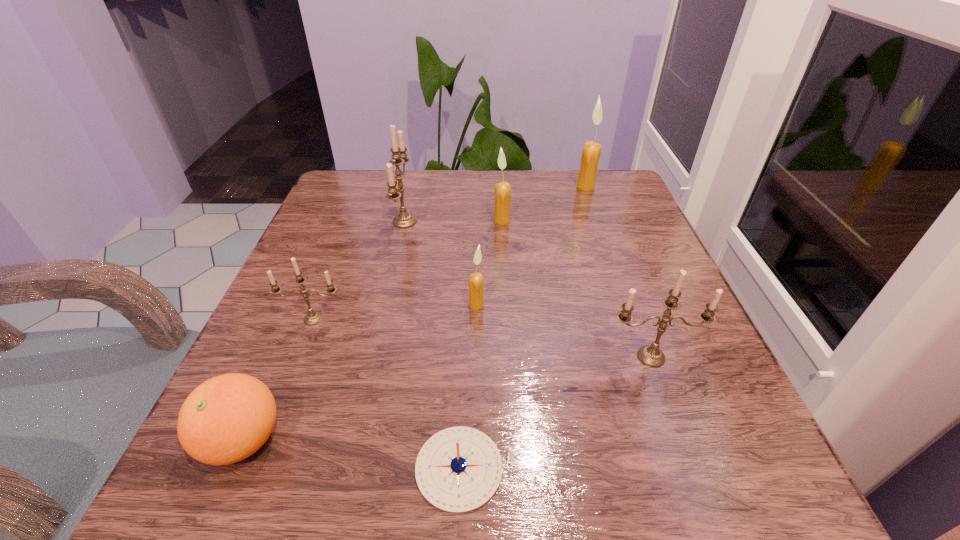
Image resolution: width=960 pixels, height=540 pixels. I want to click on the leftmost metallic candle, so click(x=312, y=318).

Locate an element on the screen. The height and width of the screenshot is (540, 960). the second nearest metallic candle is located at coordinates (312, 318).

Locate an element on the screen. orange orange is located at coordinates (227, 418).

The image size is (960, 540). Find the location of `orange`. orange is located at coordinates (227, 418).

Where is `the shortest object`? the shortest object is located at coordinates (458, 469).

In order to click on blue compass in this screenshot , I will do `click(458, 469)`.

The image size is (960, 540). Find the location of `vacant space located on the right of the second metallic candle from right to left`. vacant space located on the right of the second metallic candle from right to left is located at coordinates (505, 222).

The image size is (960, 540). In order to click on vacant point located on the front of the farthest object in this screenshot , I will do `click(628, 303)`.

This screenshot has width=960, height=540. What are the coordinates of `vacant area situated 0.210m on the right of the second cream candle from left to right` in the screenshot? It's located at (602, 220).

This screenshot has height=540, width=960. What are the coordinates of `vacant space situated on the left of the nearest candle` in the screenshot? It's located at (499, 357).